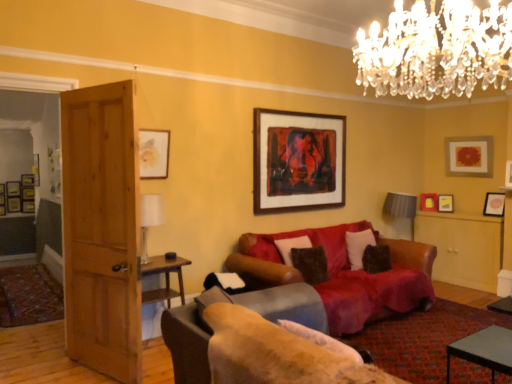
Question: Can leather couch at center, the 2th studio couch when ordered from front to back, be found inside matte yellow picture frame at upper right, which is counted as the 6th picture frame, starting from the back?

Choices:
 (A) yes
 (B) no

Answer: (B)

Question: Is matte yellow picture frame at upper right, placed as the fifth picture frame when sorted from front to back, positioned beyond the bounds of leather couch at center, the 2th studio couch when ordered from front to back?

Choices:
 (A) yes
 (B) no

Answer: (A)

Question: Is matte yellow picture frame at upper right, placed as the fifth picture frame when sorted from front to back, oriented away from leather couch at center, placed as the first studio couch when sorted from back to front?

Choices:
 (A) no
 (B) yes

Answer: (A)

Question: Is matte yellow picture frame at upper right, which is counted as the 6th picture frame, starting from the back, to the left of leather couch at center, the 2th studio couch when ordered from front to back, from the viewer's perspective?

Choices:
 (A) no
 (B) yes

Answer: (A)

Question: Considering the relative sizes of matte yellow picture frame at upper right, which is counted as the 6th picture frame, starting from the back, and leather couch at center, placed as the first studio couch when sorted from back to front, in the image provided, is matte yellow picture frame at upper right, which is counted as the 6th picture frame, starting from the back, taller than leather couch at center, placed as the first studio couch when sorted from back to front,?

Choices:
 (A) yes
 (B) no

Answer: (B)

Question: Considering the relative sizes of matte yellow picture frame at upper right, placed as the fifth picture frame when sorted from front to back, and leather couch at center, the 2th studio couch when ordered from front to back, in the image provided, is matte yellow picture frame at upper right, placed as the fifth picture frame when sorted from front to back, smaller than leather couch at center, the 2th studio couch when ordered from front to back,?

Choices:
 (A) yes
 (B) no

Answer: (A)

Question: Is wooden framed artwork at upper center, the 2th picture frame viewed from the front, shorter than velvet brown couch at center, placed as the second studio couch when sorted from back to front?

Choices:
 (A) yes
 (B) no

Answer: (B)

Question: Considering the relative sizes of wooden framed artwork at upper center, the fifth picture frame from the right, and velvet brown couch at center, placed as the second studio couch when sorted from back to front, in the image provided, is wooden framed artwork at upper center, the fifth picture frame from the right, bigger than velvet brown couch at center, placed as the second studio couch when sorted from back to front,?

Choices:
 (A) yes
 (B) no

Answer: (B)

Question: Is wooden framed artwork at upper center, marked as the 9th picture frame in a back-to-front arrangement, at the right side of velvet brown couch at center, which is the first studio couch in front-to-back order?

Choices:
 (A) no
 (B) yes

Answer: (B)

Question: Is wooden framed artwork at upper center, the 6th picture frame positioned from the left, closer to the viewer compared to velvet brown couch at center, placed as the second studio couch when sorted from back to front?

Choices:
 (A) yes
 (B) no

Answer: (B)

Question: Is wooden framed artwork at upper center, the 2th picture frame viewed from the front, to the left of velvet brown couch at center, placed as the second studio couch when sorted from back to front, from the viewer's perspective?

Choices:
 (A) yes
 (B) no

Answer: (B)

Question: Is wooden framed artwork at upper center, the 2th picture frame viewed from the front, with velvet brown couch at center, which is the first studio couch in front-to-back order?

Choices:
 (A) yes
 (B) no

Answer: (B)

Question: Is velvet dark brown pillow at center, positioned as the second pillow in back-to-front order, to the left of matte wooden picture frame at upper left, acting as the 8th picture frame starting from the front, from the viewer's perspective?

Choices:
 (A) yes
 (B) no

Answer: (B)